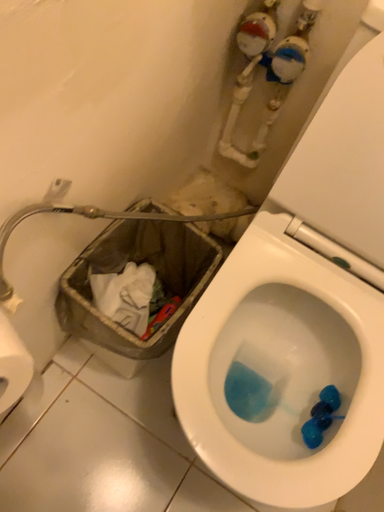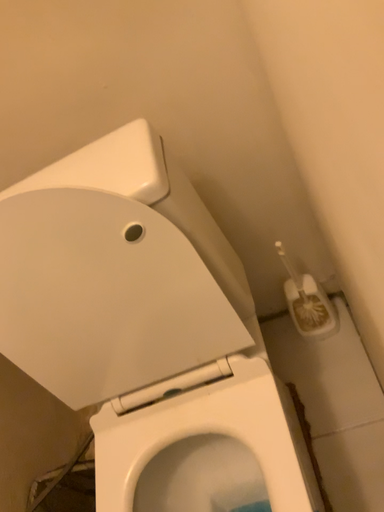
Question: How did the camera likely rotate when shooting the video?

Choices:
 (A) rotated right
 (B) rotated left

Answer: (B)